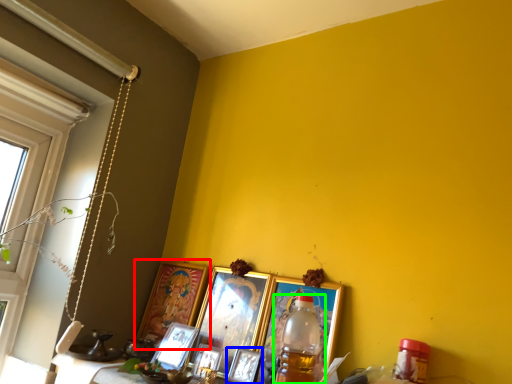
Question: Estimate the real-world distances between objects in this image. Which object is farther from picture frame (highlighted by a red box), picture frame (highlighted by a blue box) or bottle (highlighted by a green box)?

Choices:
 (A) picture frame
 (B) bottle

Answer: (B)